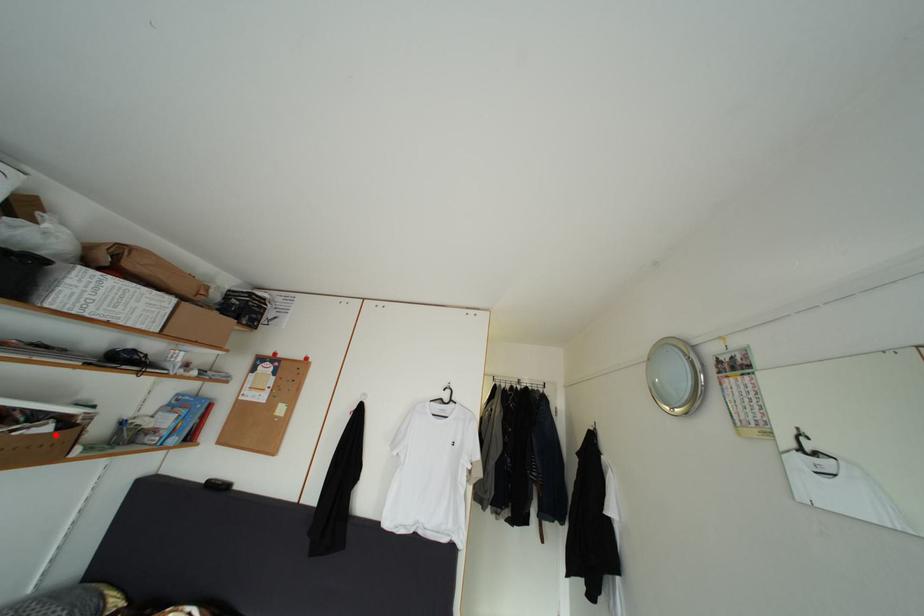
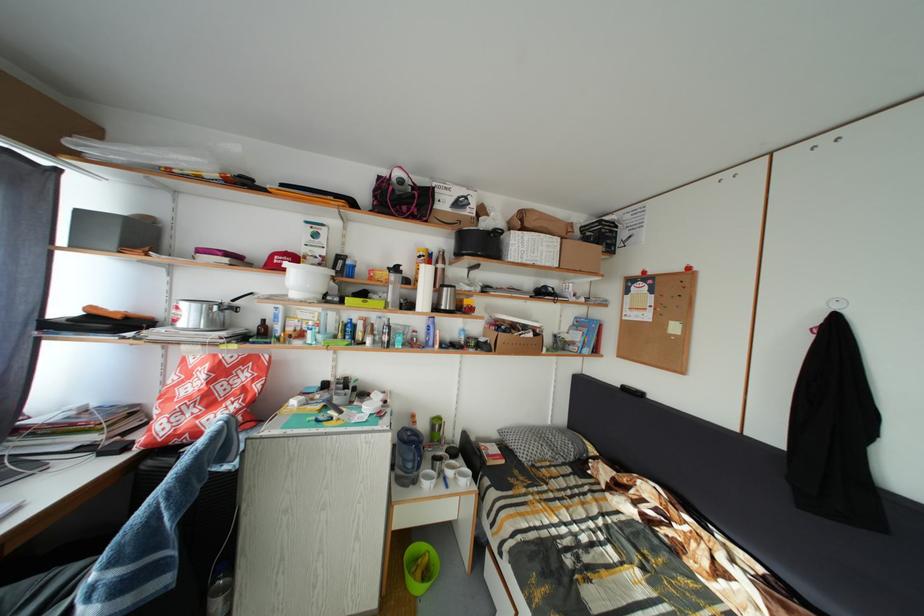
Question: I am providing you with two images of the same scene from different viewpoints. Given a red point in image1, look at the same physical point in image2. Is it:

Choices:
 (A) Closer to the viewpoint
 (B) Farther from the viewpoint

Answer: (B)